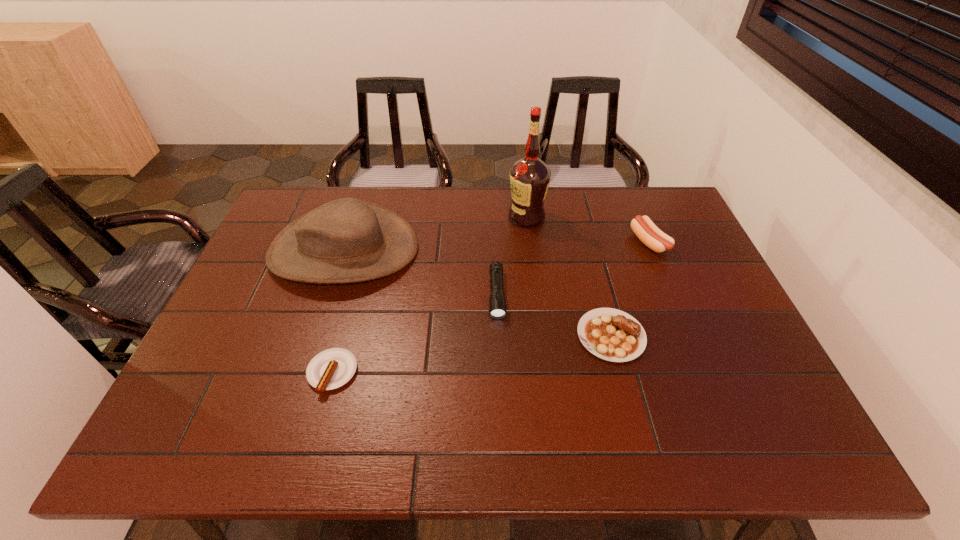
The height and width of the screenshot is (540, 960). In order to click on free region located 0.280m on the label of the tallest object in this screenshot , I will do `click(423, 217)`.

At what (x,y) coordinates should I click in order to perform the action: click on free spot located 0.220m on the label of the tallest object. Please return your answer as a coordinate pair (x, y). This screenshot has width=960, height=540. Looking at the image, I should click on (442, 217).

Locate an element on the screen. vacant space positioned on the label of the tallest object is located at coordinates (435, 217).

Locate an element on the screen. The image size is (960, 540). vacant space located 0.080m on the back of the cowboy hat is located at coordinates (361, 199).

Image resolution: width=960 pixels, height=540 pixels. I want to click on vacant space located on the back of the third tallest object, so click(x=627, y=190).

Where is `free space located 0.130m at the lens end of the third object from left to right`? free space located 0.130m at the lens end of the third object from left to right is located at coordinates (499, 362).

Find the location of `free spot located on the front of the fifth object from left to right`. free spot located on the front of the fifth object from left to right is located at coordinates pos(636,432).

Where is `vacant space situated 0.200m on the right of the shortest object`? vacant space situated 0.200m on the right of the shortest object is located at coordinates (442, 373).

Image resolution: width=960 pixels, height=540 pixels. I want to click on alcohol that is positioned at the far edge, so coord(530,177).

You are a GUI agent. You are given a task and a screenshot of the screen. Output one action in this format:
    pyautogui.click(x=<x>, y=<y>)
    Task: Click on the cowboy hat situated at the far edge
    This screenshot has height=540, width=960.
    Given the screenshot: What is the action you would take?
    coord(347,240)